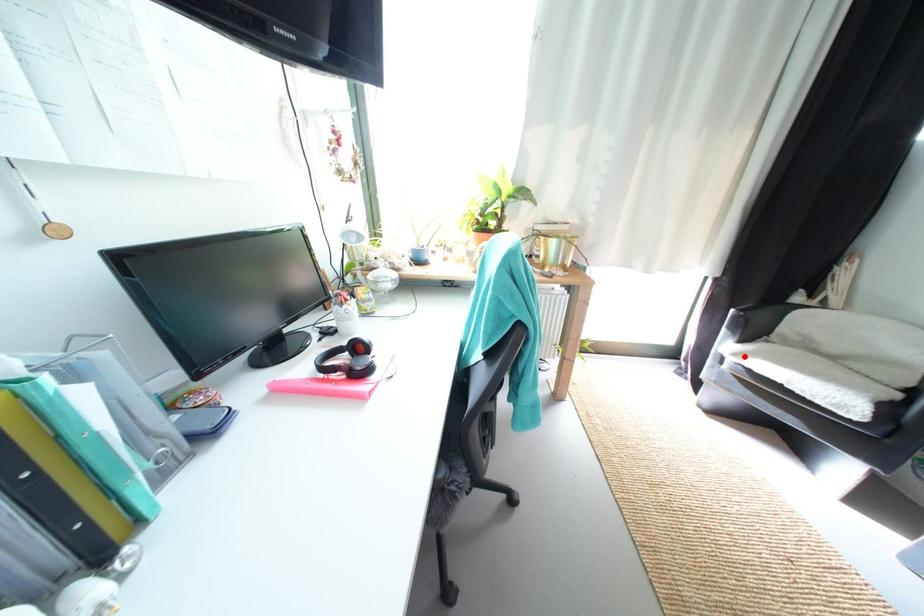
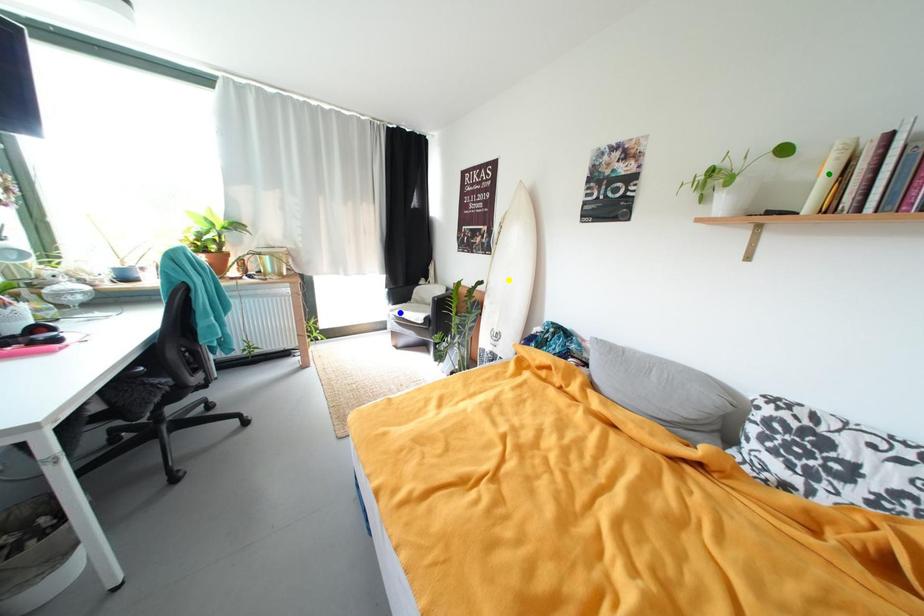
Question: I am providing you with two images of the same scene from different viewpoints. A red point is marked on the first image. You are given multiple points on the second image. Which point in image 2 is actually the same real-world point as the red point in image 1?

Choices:
 (A) green point
 (B) blue point
 (C) yellow point

Answer: (B)